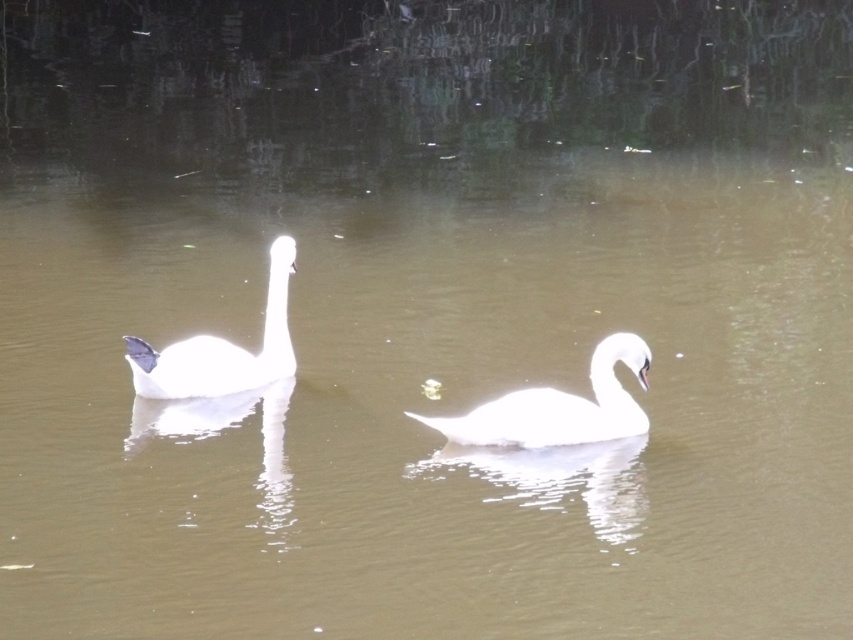
Question: Among these points, which one is farthest from the camera?

Choices:
 (A) (621, 336)
 (B) (279, 259)

Answer: (B)

Question: Among these objects, which one is farthest from the camera?

Choices:
 (A) white glossy swan at left
 (B) white glossy swan at center

Answer: (A)

Question: Does white glossy swan at center have a lesser width compared to white glossy swan at left?

Choices:
 (A) yes
 (B) no

Answer: (B)

Question: Is white glossy swan at center thinner than white glossy swan at left?

Choices:
 (A) yes
 (B) no

Answer: (B)

Question: Can you confirm if white glossy swan at center is bigger than white glossy swan at left?

Choices:
 (A) no
 (B) yes

Answer: (A)